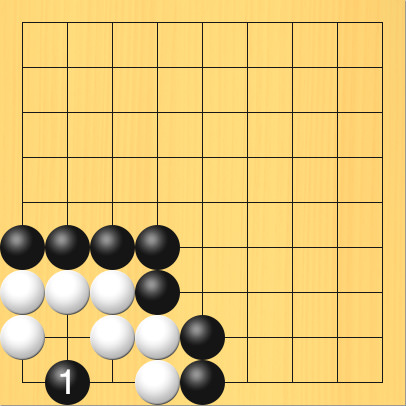
Find the location of a particular element. This screenshot has width=406, height=406. columns is located at coordinates (44, 39), (106, 33), (126, 36), (175, 41), (226, 42), (277, 41), (320, 45), (348, 47).